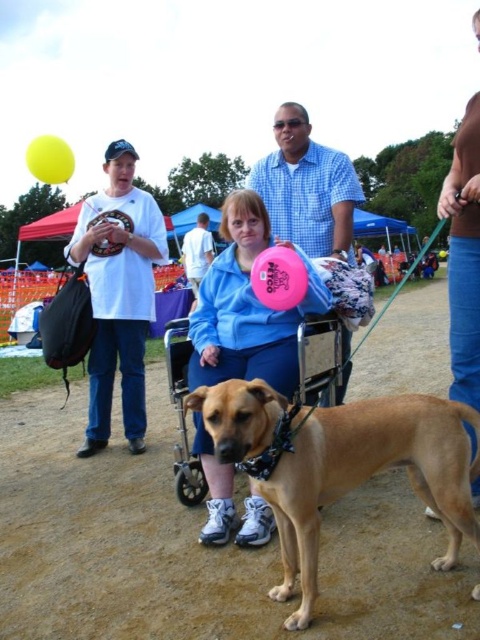
You are a photographer at the event and want to capture a photo that includes both the blue checkered shirt at center and the yellow rubber balloon at upper left. Which object should you focus on first to ensure both are in frame without moving the camera?

You should focus on the blue checkered shirt at center first because it occupies less space than the yellow rubber balloon at upper left, so it will be easier to include both in the frame by centering the smaller object first.

Looking at this image, you are a photographer planning to take a group photo of the matte blue jacket at center and the blue checkered shirt at center. Which one should you focus on first if you want the larger object to be in focus?

The matte blue jacket at center is bigger than the blue checkered shirt at center, so you should focus on the matte blue jacket at center first to ensure it is in focus.